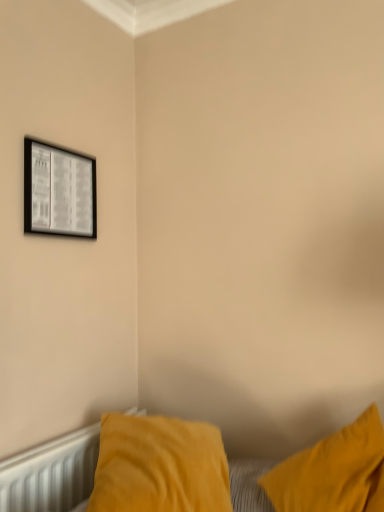
The width and height of the screenshot is (384, 512). What do you see at coordinates (51, 474) in the screenshot?
I see `velvet yellow pillow at lower right` at bounding box center [51, 474].

Describe the element at coordinates (59, 191) in the screenshot. I see `black glossy picture frame at upper left` at that location.

Find the location of `velvet yellow pillow at lower right`. velvet yellow pillow at lower right is located at coordinates (51, 474).

Is velvet yellow pillow at lower right at the back of white textured radiator at lower left?

No, white textured radiator at lower left is not facing the opposite direction of velvet yellow pillow at lower right.

From the image's perspective, is white textured radiator at lower left on top of velvet yellow pillow at lower right?

No.

Looking at this image, are white textured radiator at lower left and velvet yellow pillow at lower right far apart?

They are positioned close to each other.

Considering the positions of objects velvet yellow pillow at lower right and white textured radiator at lower left in the image provided, who is behind, velvet yellow pillow at lower right or white textured radiator at lower left?

white textured radiator at lower left is further away from the camera.

Is point (39, 459) farther from viewer compared to point (20, 485)?

Yes, it is behind point (20, 485).

From the image's perspective, is velvet yellow pillow at lower right located above or below white textured radiator at lower left?

Based on their image positions, velvet yellow pillow at lower right is located above white textured radiator at lower left.

Is velvet yellow pillow at lower right smaller than white textured radiator at lower left?

No, velvet yellow pillow at lower right is not smaller than white textured radiator at lower left.

Is velvet yellow pillow at lower right positioned with its back to black glossy picture frame at upper left?

velvet yellow pillow at lower right does not have its back to black glossy picture frame at upper left.

Based on the photo, from the image's perspective, does velvet yellow pillow at lower right appear higher than black glossy picture frame at upper left?

Actually, velvet yellow pillow at lower right appears below black glossy picture frame at upper left in the image.

Based on their positions, is velvet yellow pillow at lower right located to the left or right of black glossy picture frame at upper left?

From the image, it's evident that velvet yellow pillow at lower right is to the right of black glossy picture frame at upper left.

Considering the positions of objects velvet yellow pillow at lower right and black glossy picture frame at upper left in the image provided, who is behind, velvet yellow pillow at lower right or black glossy picture frame at upper left?

black glossy picture frame at upper left is behind.

From the image's perspective, which is below, white textured radiator at lower left or black glossy picture frame at upper left?

From the image's view, white textured radiator at lower left is below.

Considering the sizes of white textured radiator at lower left and black glossy picture frame at upper left in the image, is white textured radiator at lower left bigger or smaller than black glossy picture frame at upper left?

Clearly, white textured radiator at lower left is larger in size than black glossy picture frame at upper left.

Where is `radiator below the black glossy picture frame at upper left (from the image's perspective)`? The width and height of the screenshot is (384, 512). radiator below the black glossy picture frame at upper left (from the image's perspective) is located at coordinates (51, 474).

Between point (94, 461) and point (39, 157), which one is positioned behind?

The point (94, 461) is more distant.

Is black glossy picture frame at upper left aimed at velvet yellow pillow at lower right?

No, black glossy picture frame at upper left is not turned towards velvet yellow pillow at lower right.

How many degrees apart are the facing directions of black glossy picture frame at upper left and velvet yellow pillow at lower right?

75.2 degrees separate the facing orientations of black glossy picture frame at upper left and velvet yellow pillow at lower right.

Is velvet yellow pillow at lower right inside black glossy picture frame at upper left?

Definitely not — velvet yellow pillow at lower right is not inside black glossy picture frame at upper left.

Looking at this image, considering the sizes of objects black glossy picture frame at upper left and velvet yellow pillow at lower right in the image provided, who is wider, black glossy picture frame at upper left or velvet yellow pillow at lower right?

With larger width is velvet yellow pillow at lower right.

Is point (90, 214) positioned after point (69, 444)?

Yes, it is.

Can you confirm if black glossy picture frame at upper left is positioned to the left of white textured radiator at lower left?

Indeed, black glossy picture frame at upper left is positioned on the left side of white textured radiator at lower left.

Measure the distance from black glossy picture frame at upper left to white textured radiator at lower left.

A distance of 33.20 inches exists between black glossy picture frame at upper left and white textured radiator at lower left.

Which of these two, black glossy picture frame at upper left or white textured radiator at lower left, is smaller?

Smaller between the two is black glossy picture frame at upper left.

Find the location of `bed located above the white textured radiator at lower left (from the image's perspective)`. bed located above the white textured radiator at lower left (from the image's perspective) is located at coordinates (51, 474).

This screenshot has height=512, width=384. Find the location of `radiator behind the velvet yellow pillow at lower right`. radiator behind the velvet yellow pillow at lower right is located at coordinates click(51, 474).

Which object lies nearer to the anchor point white textured radiator at lower left, velvet yellow pillow at lower right or black glossy picture frame at upper left?

velvet yellow pillow at lower right lies closer to white textured radiator at lower left than the other object.

When comparing their distances from velvet yellow pillow at lower right, does black glossy picture frame at upper left or white textured radiator at lower left seem closer?

The object closer to velvet yellow pillow at lower right is white textured radiator at lower left.

When comparing their distances from black glossy picture frame at upper left, does white textured radiator at lower left or velvet yellow pillow at lower right seem further?

velvet yellow pillow at lower right is further to black glossy picture frame at upper left.

When comparing their distances from white textured radiator at lower left, does black glossy picture frame at upper left or velvet yellow pillow at lower right seem closer?

velvet yellow pillow at lower right.

Which object lies further to the anchor point velvet yellow pillow at lower right, white textured radiator at lower left or black glossy picture frame at upper left?

black glossy picture frame at upper left is further to velvet yellow pillow at lower right.

Looking at the image, which one is located closer to black glossy picture frame at upper left, velvet yellow pillow at lower right or white textured radiator at lower left?

Among the two, white textured radiator at lower left is located nearer to black glossy picture frame at upper left.

Where is `bed between black glossy picture frame at upper left and white textured radiator at lower left in the vertical direction`? The image size is (384, 512). bed between black glossy picture frame at upper left and white textured radiator at lower left in the vertical direction is located at coordinates (51, 474).